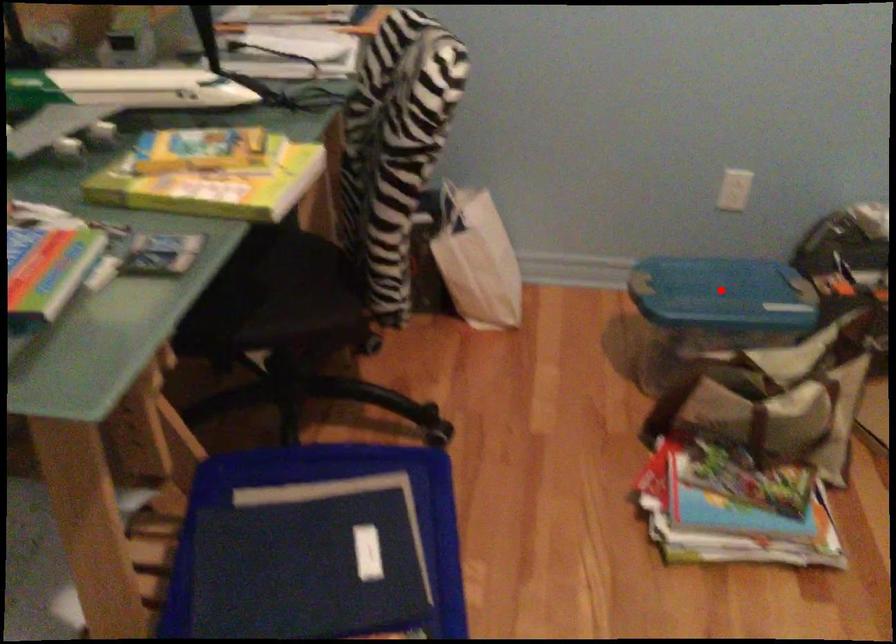
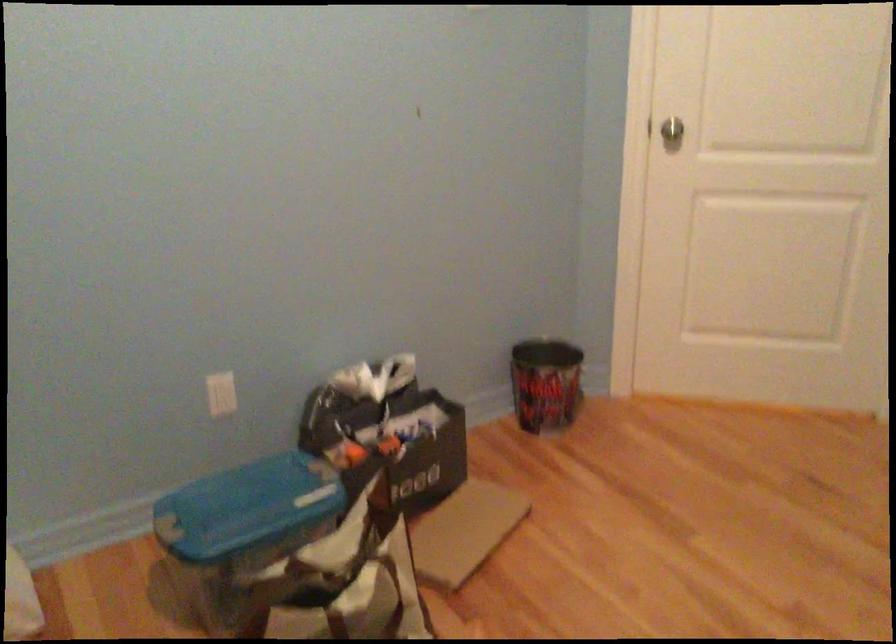
The point at the highlighted location is marked in the first image. Where is the corresponding point in the second image?

(247, 507)